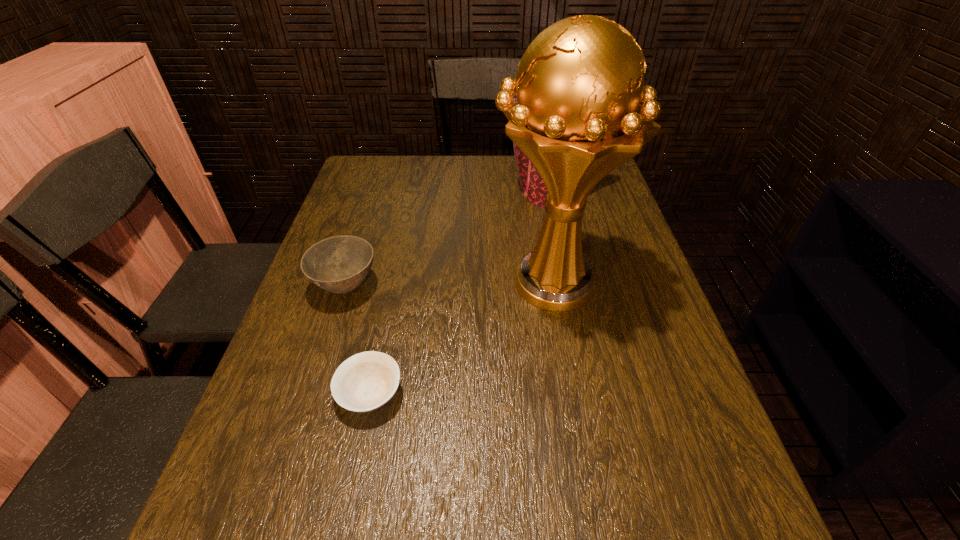
Identify the location of vacant space at the near left corner. (297, 530).

Locate an element on the screen. free point at the far right corner is located at coordinates pyautogui.click(x=596, y=186).

Find the location of a particular element. The width and height of the screenshot is (960, 540). vacant space that's between the trophy_cup and the shortest object is located at coordinates (461, 339).

What are the coordinates of `vacant space in between the tallest object and the shorter bowl` in the screenshot? It's located at (461, 339).

You are a GUI agent. You are given a task and a screenshot of the screen. Output one action in this format:
    pyautogui.click(x=<x>, y=<y>)
    Task: Click on the free space that is in between the taller bowl and the handbag
    The width and height of the screenshot is (960, 540).
    Given the screenshot: What is the action you would take?
    pos(447,240)

Where is `vacant area that lies between the nearer bowl and the farthest object`? The image size is (960, 540). vacant area that lies between the nearer bowl and the farthest object is located at coordinates (460, 294).

The width and height of the screenshot is (960, 540). Identify the location of vacant area that lies between the nearest object and the farther bowl. (358, 341).

Where is `vacant area that lies between the second shortest object and the third shortest object`? The width and height of the screenshot is (960, 540). vacant area that lies between the second shortest object and the third shortest object is located at coordinates (447, 240).

Where is `empty location between the tallest object and the taller bowl`? This screenshot has height=540, width=960. empty location between the tallest object and the taller bowl is located at coordinates (448, 285).

Choose which object is the third nearest neighbor to the shorter bowl. Please provide its 2D coordinates. Your answer should be formatted as a tuple, i.e. [(x, y)], where the tuple contains the x and y coordinates of a point satisfying the conditions above.

[(533, 187)]